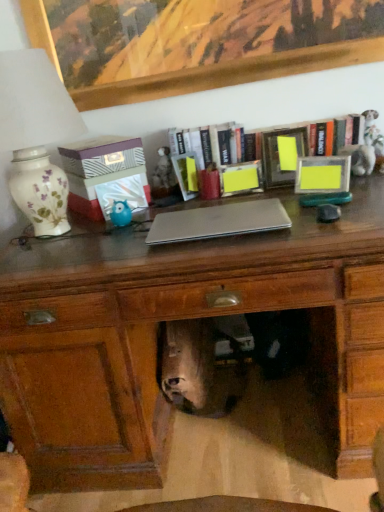
At what (x,y) coordinates should I click in order to perform the action: click on vacant region above silver metallic laptop at center (from a real-world perspective). Please return your answer as a coordinate pair (x, y). Image resolution: width=384 pixels, height=512 pixels. Looking at the image, I should click on (203, 219).